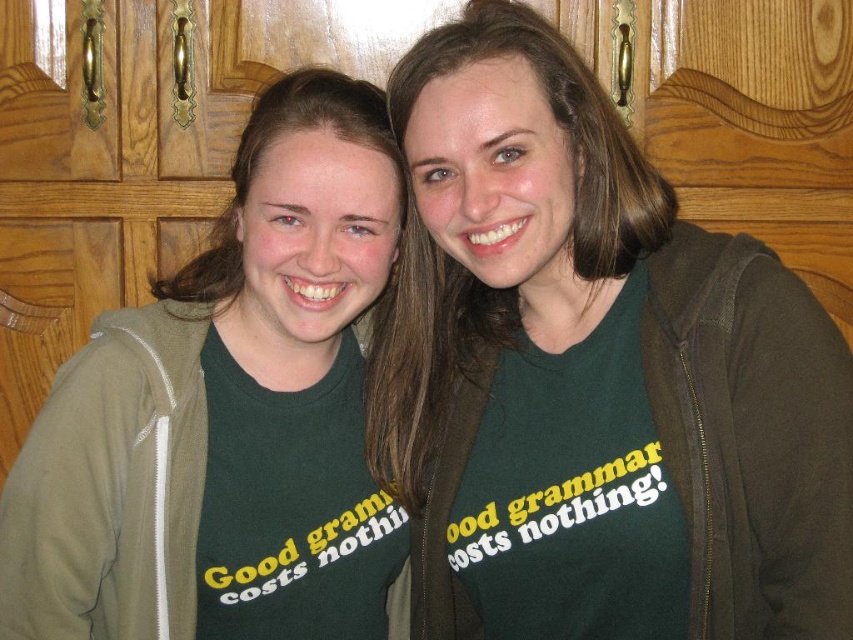
Question: Does green matte t-shirt at center appear on the right side of green jersey at right?

Choices:
 (A) no
 (B) yes

Answer: (A)

Question: Does green matte t-shirt at center have a greater width compared to green jersey at right?

Choices:
 (A) no
 (B) yes

Answer: (A)

Question: Which of the following is the farthest from the observer?

Choices:
 (A) (851, 568)
 (B) (351, 412)

Answer: (B)

Question: Among these objects, which one is nearest to the camera?

Choices:
 (A) green jersey at right
 (B) green matte t-shirt at center

Answer: (A)

Question: Does green matte t-shirt at center have a larger size compared to green jersey at right?

Choices:
 (A) no
 (B) yes

Answer: (B)